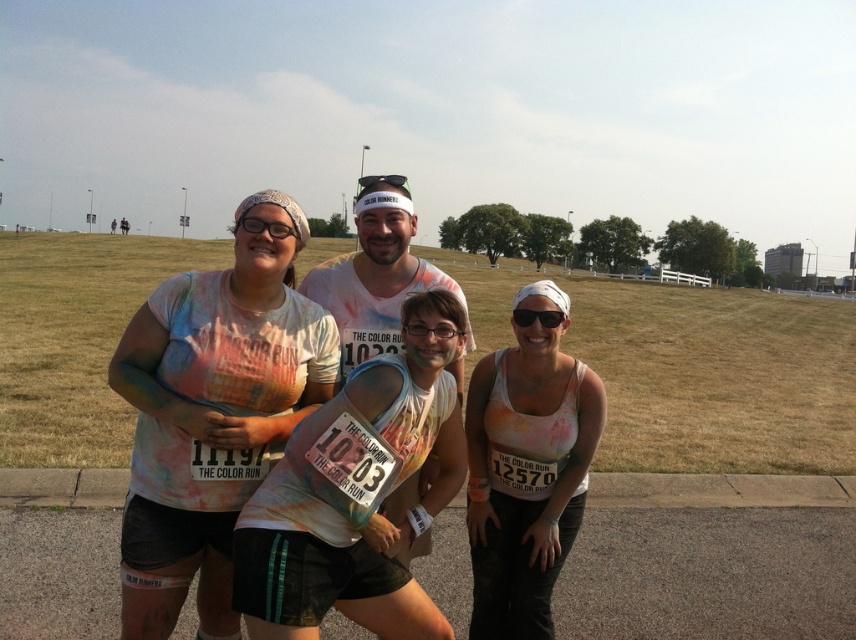
Question: Is the position of transparent plastic goggles at center less distant than that of black matte goggles at center?

Choices:
 (A) yes
 (B) no

Answer: (A)

Question: Can you confirm if multicolored tie-dye shirt at center is thinner than matte white tank top at center?

Choices:
 (A) yes
 (B) no

Answer: (B)

Question: Estimate the real-world distances between objects in this image. Which object is farther from the multicolored tie-dye shirt at center?

Choices:
 (A) multicolored fabric shirt at center
 (B) matte white tank top at center
 (C) painted cotton shirt at center

Answer: (B)

Question: Which point is closer to the camera?

Choices:
 (A) (516, 314)
 (B) (408, 189)

Answer: (A)

Question: Can you confirm if multicolored tie-dye shirt at center is smaller than black matte goggles at center?

Choices:
 (A) no
 (B) yes

Answer: (B)

Question: Which of these objects is positioned closest to the transparent plastic goggles at center?

Choices:
 (A) multicolored fabric shirt at center
 (B) matte white tank top at center
 (C) painted cotton shirt at center

Answer: (C)